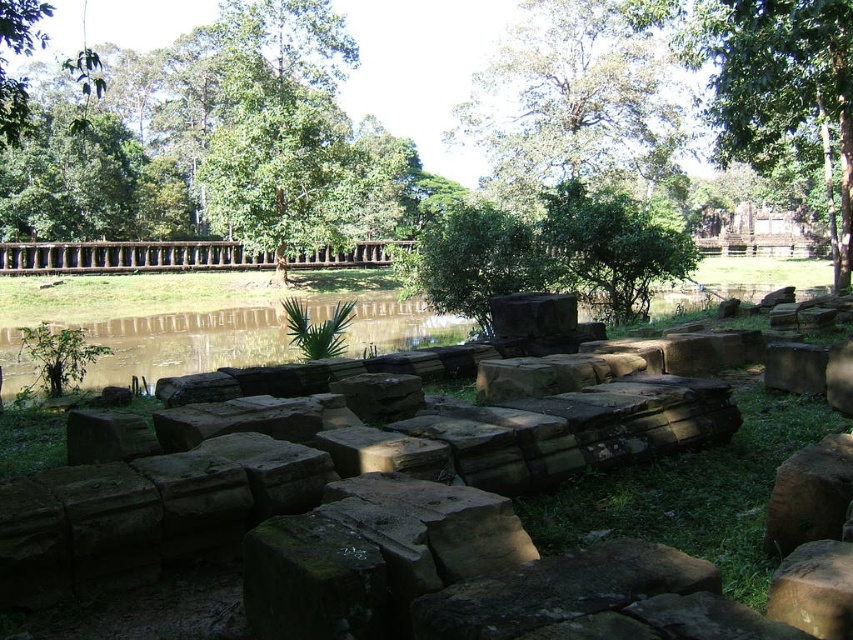
You are a hiker standing at the base of the ancient ruins. You notice two green leafy trees in the distance. Which tree, the green leafy tree at upper center or the green leafy tree at upper right, appears to be wider from your vantage point?

The green leafy tree at upper center might be wider than the green leafy tree at upper right according to the description.

You are standing at the ruins and want to take a photo of the green leafy tree at upper center. If your camera has a maximum zoom range of 20 meters, will you be able to capture the tree clearly without moving closer?

The green leafy tree at upper center is 25.54 meters away from the viewer, which exceeds the camera maximum zoom range of 20 meters. Therefore, you won t be able to capture the tree clearly without moving closer.